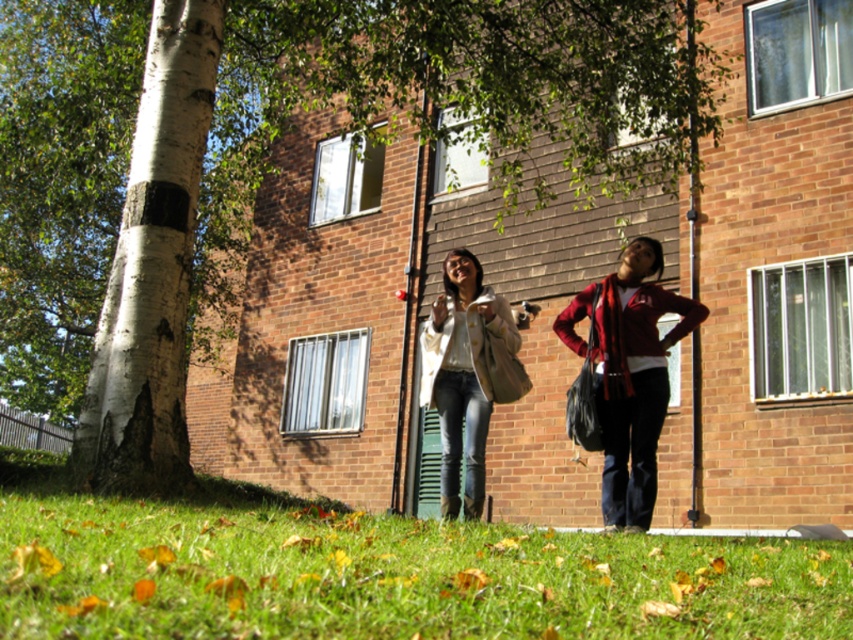
You are standing in the outdoor scene and want to place a small potted plant on the ground near the green grass at lower center. If you move the red plaid scarf at lower right out of the way, will there be enough space to place the plant?

The green grass at lower center is located below the red plaid scarf at lower right. Since the grass is below the scarf, moving the scarf out of the way would free up space above it, allowing you to place the potted plant near the green grass at lower center.

You are a painter setting up an easel to paint the scene. You want to ensure the white bark tree at left is visible in your painting without being blocked by the white matte jacket at center. Based on their heights, which object should you position closer to the foreground to achieve this?

The white bark tree at left is taller than the white matte jacket at center. To ensure the tree remains visible and not blocked by the jacket, position the white matte jacket at center closer to the foreground. This way, the taller tree can be placed behind the jacket while still being visible in the painting.